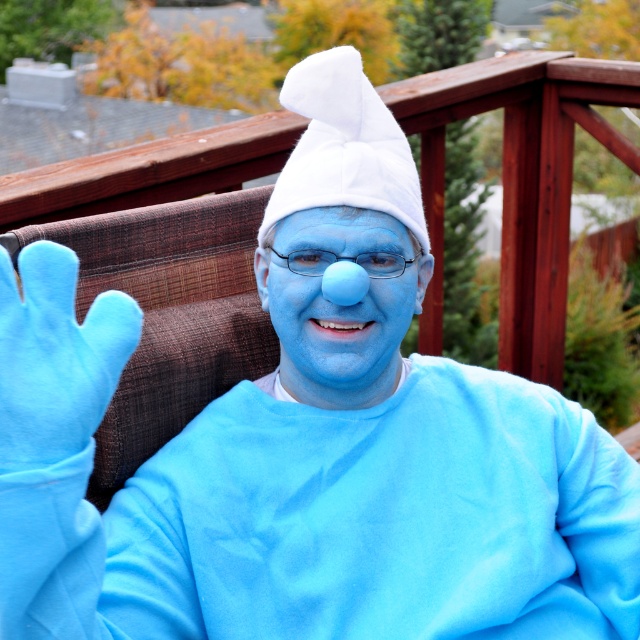
Question: Which point is farther to the camera?

Choices:
 (A) (83, 330)
 (B) (300, 240)

Answer: (B)

Question: Observing the image, what is the correct spatial positioning of fuzzy blue glove at left in reference to matte blue nose at center?

Choices:
 (A) left
 (B) right

Answer: (A)

Question: Does fuzzy blue glove at left appear on the left side of matte blue nose at center?

Choices:
 (A) yes
 (B) no

Answer: (A)

Question: Among these points, which one is nearest to the camera?

Choices:
 (A) (4, 440)
 (B) (349, 380)

Answer: (A)

Question: Can you confirm if fuzzy blue glove at left is smaller than matte blue nose at center?

Choices:
 (A) yes
 (B) no

Answer: (A)